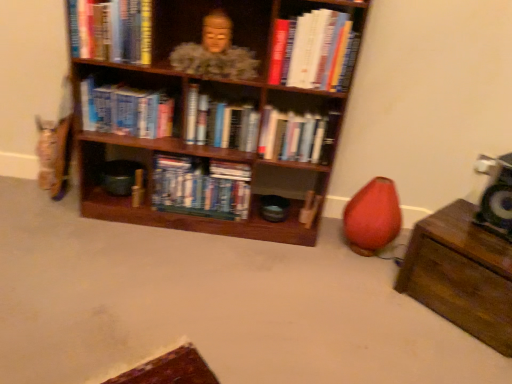
Question: Is wooden bookshelf at center wider than hardcover books at center, which is counted as the second book, starting from the right?

Choices:
 (A) yes
 (B) no

Answer: (A)

Question: From the image's perspective, is wooden bookshelf at center on top of hardcover books at center, the fifth book when ordered from left to right?

Choices:
 (A) no
 (B) yes

Answer: (B)

Question: Does wooden bookshelf at center lie behind hardcover books at center, the fifth book when ordered from left to right?

Choices:
 (A) yes
 (B) no

Answer: (B)

Question: Can you confirm if wooden bookshelf at center is thinner than hardcover books at center, which is counted as the second book, starting from the right?

Choices:
 (A) yes
 (B) no

Answer: (B)

Question: Is wooden bookshelf at center far away from hardcover books at center, which is counted as the second book, starting from the right?

Choices:
 (A) no
 (B) yes

Answer: (A)

Question: Looking at their shapes, would you say matte pink bean bag chair at lower right is wider or thinner than hardcover book at upper right, which appears as the 1th book when viewed from the right?

Choices:
 (A) thin
 (B) wide

Answer: (B)

Question: Considering their positions, is matte pink bean bag chair at lower right located in front of or behind hardcover book at upper right, which appears as the 1th book when viewed from the right?

Choices:
 (A) front
 (B) behind

Answer: (B)

Question: From the image's perspective, is matte pink bean bag chair at lower right above or below hardcover book at upper right, which is counted as the sixth book, starting from the left?

Choices:
 (A) below
 (B) above

Answer: (A)

Question: In terms of height, does matte pink bean bag chair at lower right look taller or shorter compared to hardcover book at upper right, which is counted as the sixth book, starting from the left?

Choices:
 (A) tall
 (B) short

Answer: (A)

Question: In terms of height, does hardcover books at center, which is the 3th book from right to left, look taller or shorter compared to wooden bookshelf at center?

Choices:
 (A) short
 (B) tall

Answer: (A)

Question: Based on their sizes in the image, would you say hardcover books at center, which is the 3th book from right to left, is bigger or smaller than wooden bookshelf at center?

Choices:
 (A) big
 (B) small

Answer: (B)

Question: Based on their positions, is hardcover books at center, positioned as the fourth book in left-to-right order, located to the left or right of wooden bookshelf at center?

Choices:
 (A) left
 (B) right

Answer: (B)

Question: From the image's perspective, is hardcover books at center, positioned as the fourth book in left-to-right order, located above or below wooden bookshelf at center?

Choices:
 (A) below
 (B) above

Answer: (A)

Question: In terms of size, does hardcover book at upper right, which appears as the 1th book when viewed from the right, appear bigger or smaller than matte pink bean bag chair at lower right?

Choices:
 (A) big
 (B) small

Answer: (B)

Question: Considering the positions of hardcover book at upper right, which appears as the 1th book when viewed from the right, and matte pink bean bag chair at lower right in the image, is hardcover book at upper right, which appears as the 1th book when viewed from the right, taller or shorter than matte pink bean bag chair at lower right?

Choices:
 (A) short
 (B) tall

Answer: (A)